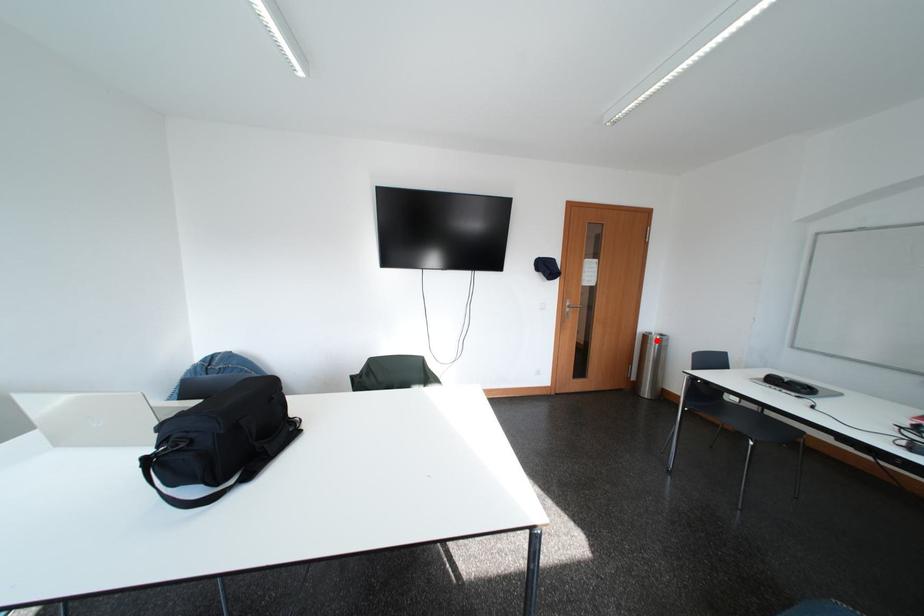
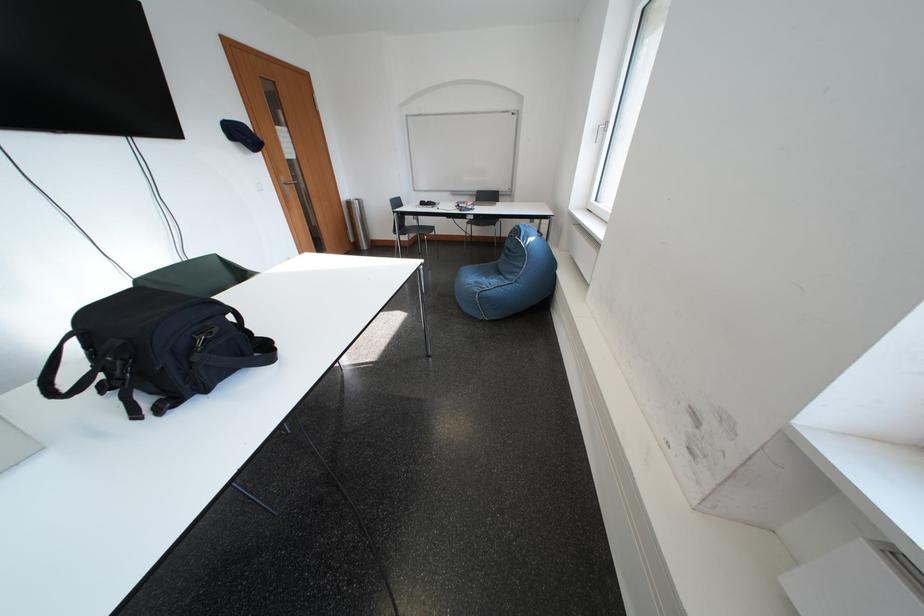
Question: A red point is marked in image1. In image2, is the corresponding 3D point closer to the camera or farther? Reply with the corresponding letter.

Choices:
 (A) The corresponding 3D point is closer.
 (B) The corresponding 3D point is farther.

Answer: (A)